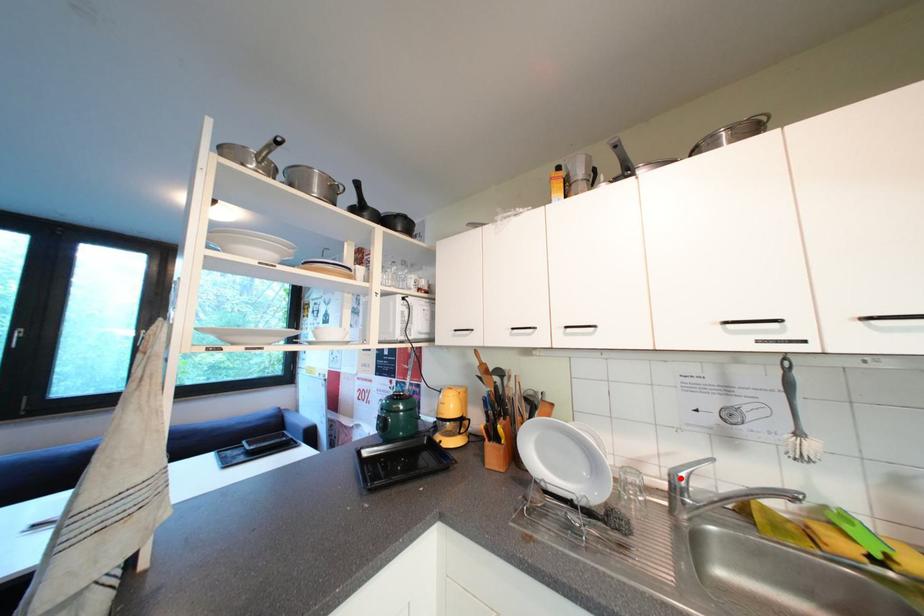
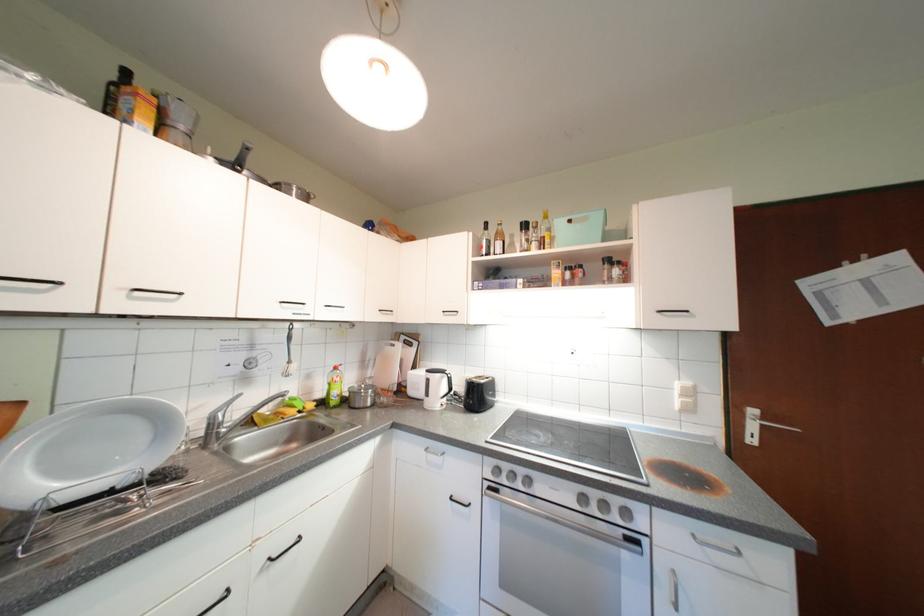
Locate, in the second image, the point that corresponds to the highlighted location in the first image.

(220, 419)